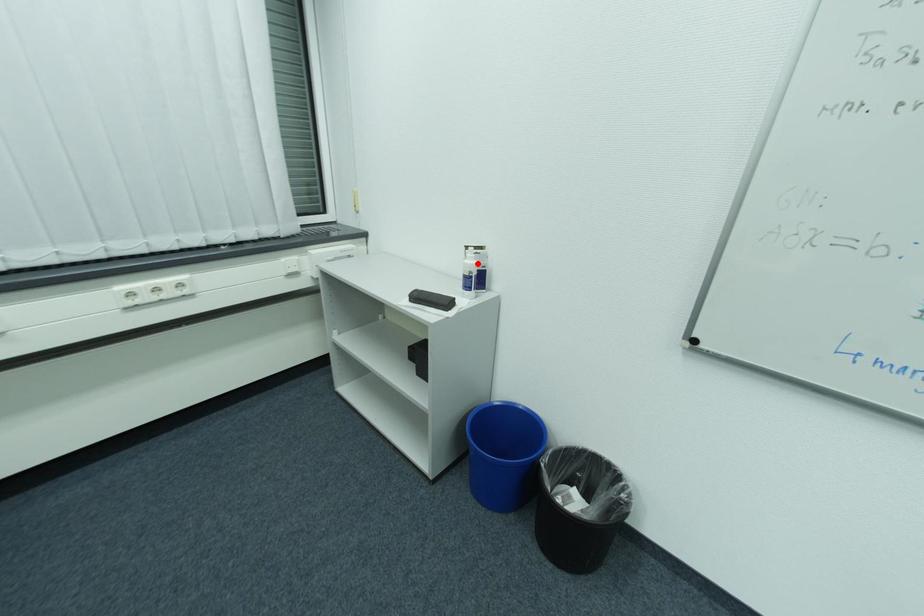
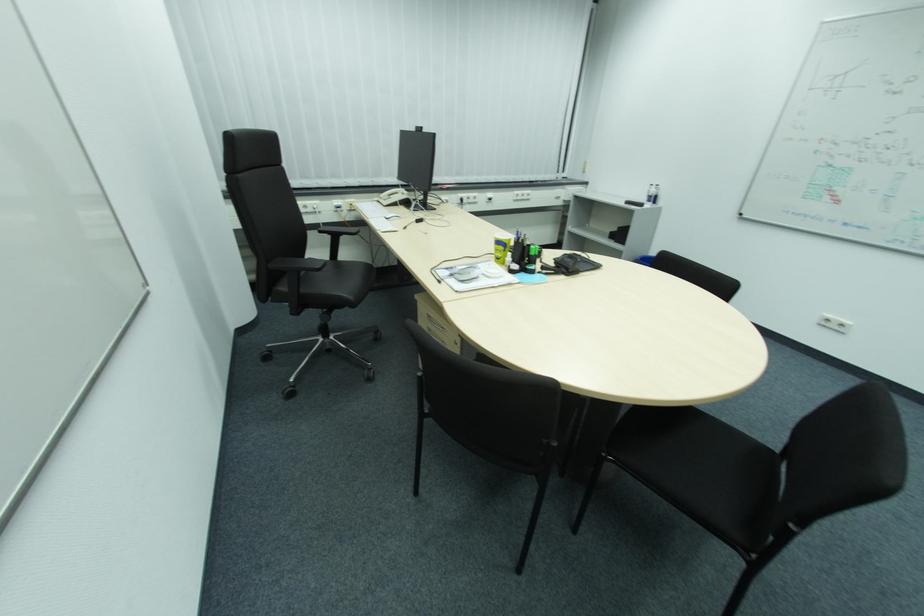
Question: I am providing you with two images of the same scene from different viewpoints. In image1, a red point is highlighted. Considering the same 3D point in image2, which of the following is correct?

Choices:
 (A) It is closer
 (B) It is farther

Answer: (A)